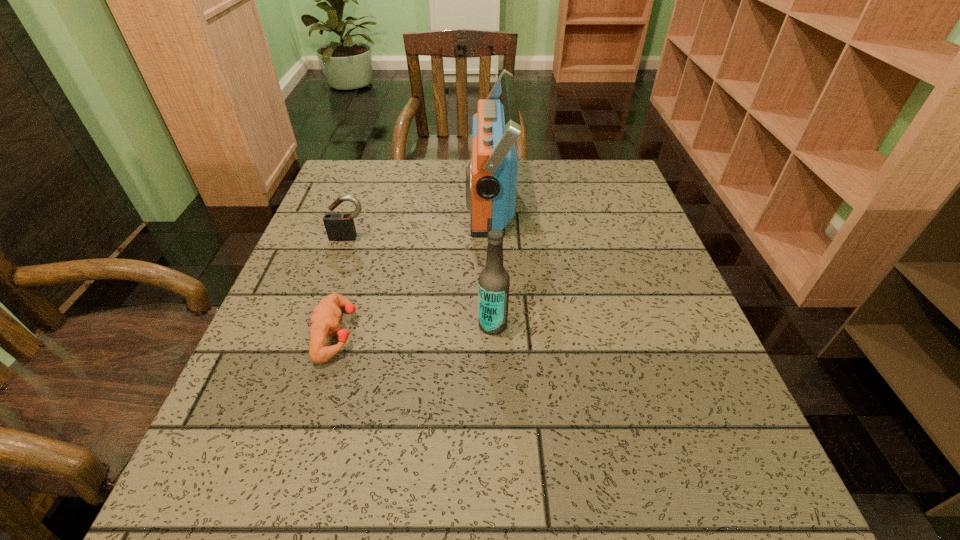
Where is `vacant space located 0.160m with the keyhole on the front of the third tallest object`? This screenshot has height=540, width=960. vacant space located 0.160m with the keyhole on the front of the third tallest object is located at coordinates (331, 289).

The height and width of the screenshot is (540, 960). I want to click on vacant position located 0.180m with the gloves of the puncher facing forward, so click(450, 333).

I want to click on object situated at the far edge, so click(491, 177).

The height and width of the screenshot is (540, 960). I want to click on padlock present at the left edge, so click(339, 226).

The width and height of the screenshot is (960, 540). In order to click on puncher present at the left edge in this screenshot , I will do [325, 320].

Where is `free space at the far edge of the desktop`? Image resolution: width=960 pixels, height=540 pixels. free space at the far edge of the desktop is located at coordinates point(548,180).

In order to click on vacant space at the near edge of the desktop in this screenshot , I will do `click(487, 501)`.

The height and width of the screenshot is (540, 960). Identify the location of vacant space at the left edge of the desktop. (301, 345).

Locate an element on the screen. Image resolution: width=960 pixels, height=540 pixels. blank space at the right edge of the desktop is located at coordinates pyautogui.click(x=660, y=305).

Locate an element on the screen. This screenshot has width=960, height=540. blank space at the far left corner of the desktop is located at coordinates click(367, 168).